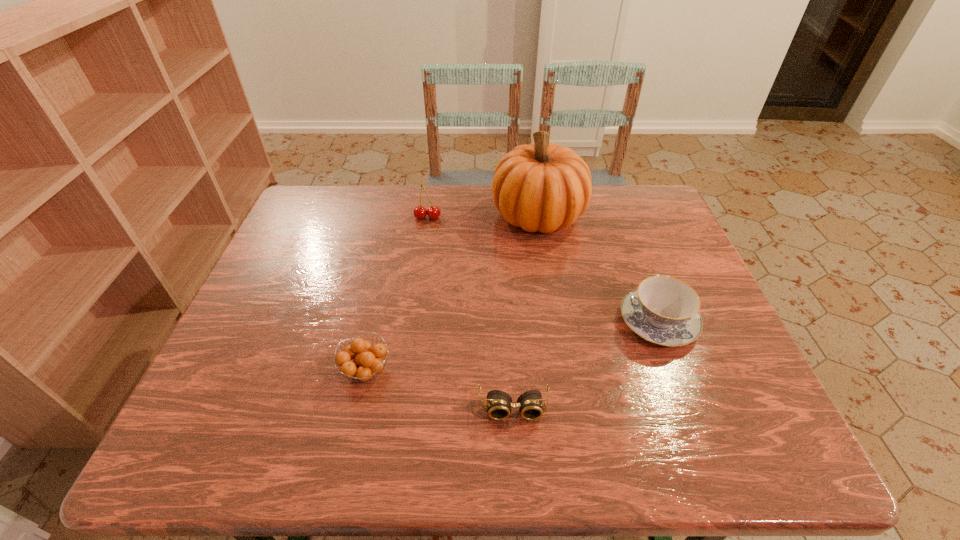
Locate an element on the screen. This screenshot has width=960, height=540. free spot located 0.150m on the right of the orange fruit is located at coordinates click(462, 372).

I want to click on pumpkin situated at the far edge, so tap(544, 187).

Locate an element on the screen. cherry that is at the far edge is located at coordinates (420, 212).

Where is `object that is at the near edge`? The image size is (960, 540). object that is at the near edge is located at coordinates (530, 403).

In order to click on object positioned at the right edge in this screenshot , I will do `click(663, 310)`.

You are a GUI agent. You are given a task and a screenshot of the screen. Output one action in this format:
    pyautogui.click(x=<x>, y=<y>)
    Task: Click on the free space at the far edge
    The height and width of the screenshot is (540, 960).
    Given the screenshot: What is the action you would take?
    [x=599, y=185]

The image size is (960, 540). Identify the location of vacant space at the near edge of the desktop. (454, 442).

At what (x,y) coordinates should I click in order to perform the action: click on free space at the left edge of the desktop. Please return your answer as a coordinate pair (x, y). Looking at the image, I should click on (246, 311).

This screenshot has width=960, height=540. Find the location of `free space at the right edge of the desktop`. free space at the right edge of the desktop is located at coordinates (673, 240).

Where is `vacant space at the far left corner`? vacant space at the far left corner is located at coordinates (322, 187).